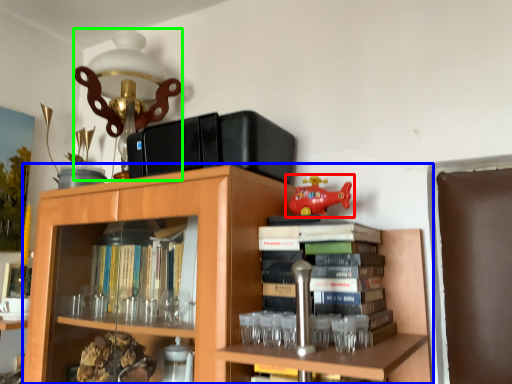
Question: Estimate the real-world distances between objects in this image. Which object is closer to toy (highlighted by a red box), bookcase (highlighted by a blue box) or table lamp (highlighted by a green box)?

Choices:
 (A) bookcase
 (B) table lamp

Answer: (A)